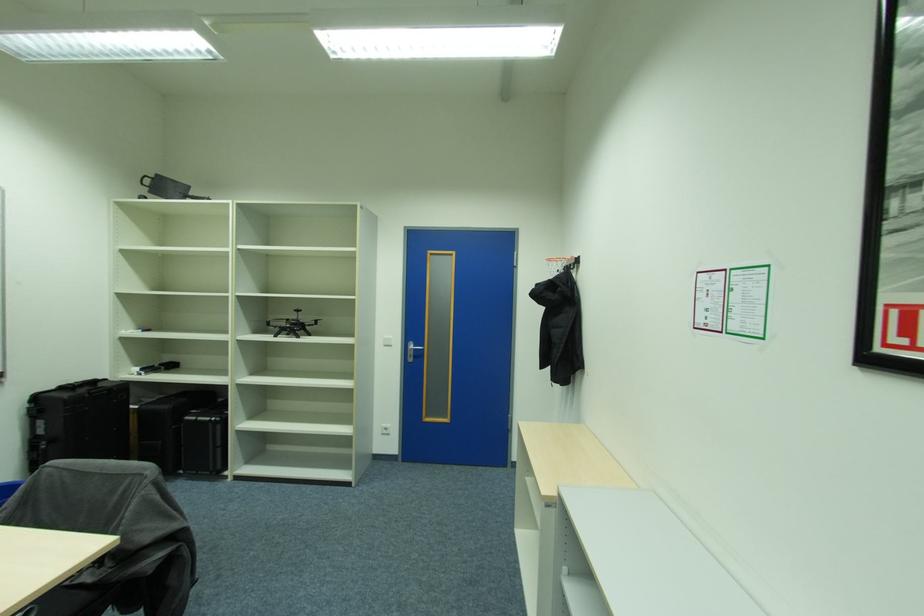
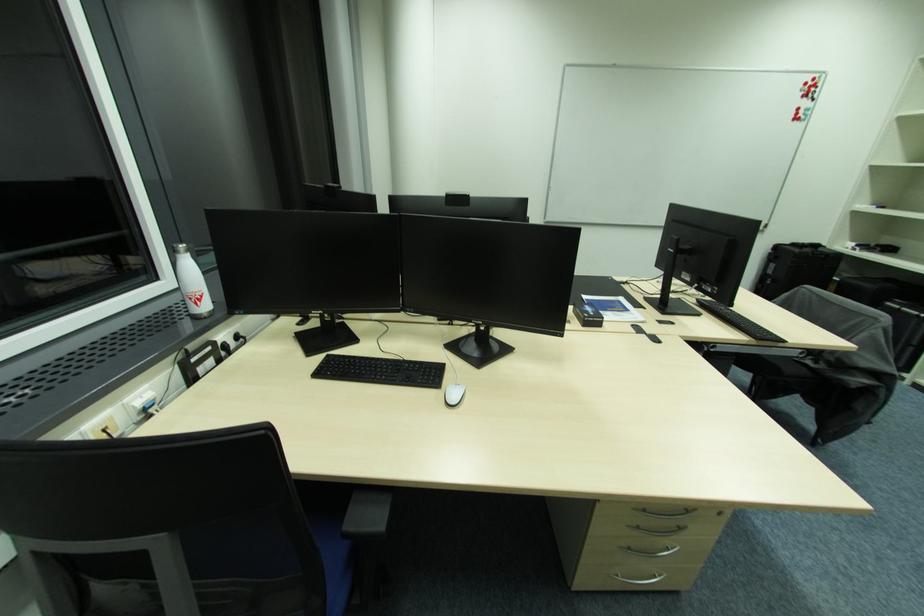
How did the camera likely rotate?

The camera rotated toward left-down.